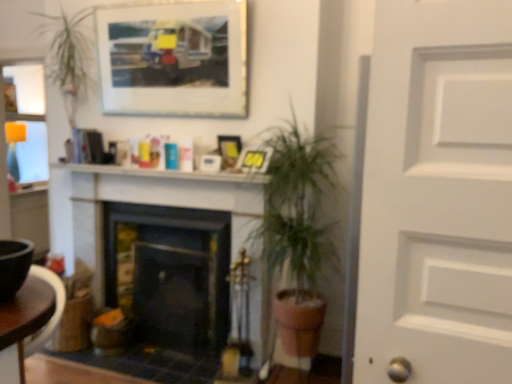
What do you see at coordinates (229, 150) in the screenshot? The width and height of the screenshot is (512, 384). I see `matte plastic picture frame at center, positioned as the second picture frame in top-to-bottom order` at bounding box center [229, 150].

Locate an element on the screen. The width and height of the screenshot is (512, 384). matte plastic picture frame at upper center, which ranks as the 3th picture frame in top-to-bottom order is located at coordinates (254, 160).

This screenshot has width=512, height=384. I want to click on green leafy plant at center, so click(x=298, y=207).

In order to face wooden frame at upper center, which is the 3th picture frame from bottom to top, should I rotate leftwards or rightwards?

You should rotate left by 11.805 degrees.

What is the approximate height of black matte fireplace at center, placed as the first fireplace when sorted from right to left?

94.80 centimeters.

Describe the element at coordinates (29, 320) in the screenshot. I see `brown wooden table at lower left` at that location.

The width and height of the screenshot is (512, 384). I want to click on matte plastic picture frame at center, positioned as the second picture frame in top-to-bottom order, so click(x=229, y=150).

Can you confirm if brown wooden table at lower left is shorter than matte plastic picture frame at center, positioned as the second picture frame in top-to-bottom order?

In fact, brown wooden table at lower left may be taller than matte plastic picture frame at center, positioned as the second picture frame in top-to-bottom order.

The height and width of the screenshot is (384, 512). In order to click on the 2nd picture frame above the brown wooden table at lower left (from the image's perspective) in this screenshot , I will do `click(229, 150)`.

Does brown wooden table at lower left have a lesser width compared to matte plastic picture frame at center, positioned as the second picture frame in top-to-bottom order?

In fact, brown wooden table at lower left might be wider than matte plastic picture frame at center, positioned as the second picture frame in top-to-bottom order.

Is brown wooden table at lower left to the right of matte plastic picture frame at center, which ranks as the second picture frame in bottom-to-top order, from the viewer's perspective?

In fact, brown wooden table at lower left is to the left of matte plastic picture frame at center, which ranks as the second picture frame in bottom-to-top order.

Starting from the green leafy plant at center, which picture frame is the 1st one behind? Please provide its 2D coordinates.

[(254, 160)]

Is point (294, 267) positioned after point (242, 152)?

No.

Does green leafy plant at center turn towards matte plastic picture frame at upper center, which ranks as the 3th picture frame in top-to-bottom order?

No, green leafy plant at center is not turned towards matte plastic picture frame at upper center, which ranks as the 3th picture frame in top-to-bottom order.

Measure the distance between green leafy plant at center and white glossy mantel at upper center.

15.46 inches.

Identify the location of mantle lying above the green leafy plant at center (from the image's perspective). The width and height of the screenshot is (512, 384). (165, 173).

Which is farther, (331, 245) or (112, 174)?

The point (112, 174) is farther.

Does green leafy plant at center appear on the left side of white glossy mantel at upper center?

No, green leafy plant at center is not to the left of white glossy mantel at upper center.

Between point (230, 160) and point (211, 99), which one is positioned behind?

The point (211, 99) is farther.

Does matte plastic picture frame at center, which ranks as the second picture frame in bottom-to-top order, have a lesser width compared to wooden frame at upper center, which is the 3th picture frame from bottom to top?

Yes, matte plastic picture frame at center, which ranks as the second picture frame in bottom-to-top order, is thinner than wooden frame at upper center, which is the 3th picture frame from bottom to top.

Which of these two, matte plastic picture frame at center, which ranks as the second picture frame in bottom-to-top order, or wooden frame at upper center, which is the 3th picture frame from bottom to top, is bigger?

With larger size is wooden frame at upper center, which is the 3th picture frame from bottom to top.

From a real-world perspective, between matte plastic picture frame at center, positioned as the second picture frame in top-to-bottom order, and wooden frame at upper center, which appears as the 1th picture frame when viewed from the top, who is vertically higher?

wooden frame at upper center, which appears as the 1th picture frame when viewed from the top, is physically above.

Is white glossy mantel at upper center not near matte plastic picture frame at center, which ranks as the second picture frame in bottom-to-top order?

white glossy mantel at upper center is near matte plastic picture frame at center, which ranks as the second picture frame in bottom-to-top order, not far away.

Is white glossy mantel at upper center positioned before matte plastic picture frame at center, positioned as the second picture frame in top-to-bottom order?

Yes, white glossy mantel at upper center is closer to the viewer.

Is white glossy mantel at upper center turned away from matte plastic picture frame at center, positioned as the second picture frame in top-to-bottom order?

white glossy mantel at upper center does not have its back to matte plastic picture frame at center, positioned as the second picture frame in top-to-bottom order.

Does white glossy mantel at upper center have a smaller size compared to matte plastic picture frame at center, which ranks as the second picture frame in bottom-to-top order?

Actually, white glossy mantel at upper center might be larger than matte plastic picture frame at center, which ranks as the second picture frame in bottom-to-top order.

Considering the points (36, 273) and (318, 249), which point is behind, point (36, 273) or point (318, 249)?

The point (318, 249) is farther.

Does brown wooden table at lower left have a greater height compared to green leafy plant at center?

In fact, brown wooden table at lower left may be shorter than green leafy plant at center.

Is brown wooden table at lower left positioned far away from green leafy plant at center?

Yes, brown wooden table at lower left and green leafy plant at center are quite far apart.

Is brown wooden table at lower left positioned behind green leafy plant at center?

No, brown wooden table at lower left is in front of green leafy plant at center.

Does matte plastic picture frame at center, which ranks as the second picture frame in bottom-to-top order, have a greater width compared to black matte fireplace at center, the first fireplace in the left-to-right sequence?

No, matte plastic picture frame at center, which ranks as the second picture frame in bottom-to-top order, is not wider than black matte fireplace at center, the first fireplace in the left-to-right sequence.

Is matte plastic picture frame at center, which ranks as the second picture frame in bottom-to-top order, bigger or smaller than black matte fireplace at center, the first fireplace in the left-to-right sequence?

matte plastic picture frame at center, which ranks as the second picture frame in bottom-to-top order, is smaller than black matte fireplace at center, the first fireplace in the left-to-right sequence.

In the scene shown: From a real-world perspective, does matte plastic picture frame at center, which ranks as the second picture frame in bottom-to-top order, sit lower than black matte fireplace at center, the 2th fireplace viewed from the right?

No, from a real-world perspective, matte plastic picture frame at center, which ranks as the second picture frame in bottom-to-top order, is not below black matte fireplace at center, the 2th fireplace viewed from the right.

Is matte plastic picture frame at center, which ranks as the second picture frame in bottom-to-top order, further to camera compared to black matte fireplace at center, the first fireplace in the left-to-right sequence?

Yes, the depth of matte plastic picture frame at center, which ranks as the second picture frame in bottom-to-top order, is greater than that of black matte fireplace at center, the first fireplace in the left-to-right sequence.

At what (x,y) coordinates should I click in order to perform the action: click on table located below the matte plastic picture frame at center, which ranks as the second picture frame in bottom-to-top order (from the image's perspective). Please return your answer as a coordinate pair (x, y). Looking at the image, I should click on (29, 320).

This screenshot has width=512, height=384. In order to click on houseplant below the matte plastic picture frame at upper center, which ranks as the 3th picture frame in top-to-bottom order (from a real-world perspective) in this screenshot , I will do `click(298, 207)`.

Considering their positions, is green leafy plant at center positioned further to matte plastic picture frame at upper center, the first picture frame in the bottom-to-top sequence, than white glossy mantel at upper center?

green leafy plant at center is further to matte plastic picture frame at upper center, the first picture frame in the bottom-to-top sequence.

Considering their positions, is black matte fireplace at center, the 2th fireplace viewed from the right, positioned further to matte plastic picture frame at upper center, which ranks as the 3th picture frame in top-to-bottom order, than brown wooden table at lower left?

brown wooden table at lower left.

From the image, which object appears to be nearer to matte plastic picture frame at upper center, which ranks as the 3th picture frame in top-to-bottom order, matte plastic picture frame at center, positioned as the second picture frame in top-to-bottom order, or black matte fireplace at center, which appears as the 2th fireplace when viewed from the left?

Based on the image, matte plastic picture frame at center, positioned as the second picture frame in top-to-bottom order, appears to be nearer to matte plastic picture frame at upper center, which ranks as the 3th picture frame in top-to-bottom order.

Estimate the real-world distances between objects in this image. Which object is closer to matte plastic picture frame at center, which ranks as the second picture frame in bottom-to-top order, green leafy plant at center or wooden frame at upper center, which appears as the 1th picture frame when viewed from the top?

green leafy plant at center is closer to matte plastic picture frame at center, which ranks as the second picture frame in bottom-to-top order.

Looking at the image, which one is located closer to green leafy plant at center, black matte fireplace at center, placed as the first fireplace when sorted from right to left, or wooden frame at upper center, which appears as the 1th picture frame when viewed from the top?

black matte fireplace at center, placed as the first fireplace when sorted from right to left, is closer to green leafy plant at center.

Looking at the image, which one is located closer to black matte fireplace at center, placed as the first fireplace when sorted from right to left, matte plastic picture frame at center, positioned as the second picture frame in top-to-bottom order, or brown wooden table at lower left?

Among the two, matte plastic picture frame at center, positioned as the second picture frame in top-to-bottom order, is located nearer to black matte fireplace at center, placed as the first fireplace when sorted from right to left.

Looking at this image, when comparing their distances from matte plastic picture frame at center, positioned as the second picture frame in top-to-bottom order, does green leafy plant at center or black matte fireplace at center, which appears as the 2th fireplace when viewed from the left, seem closer?

Among the two, green leafy plant at center is located nearer to matte plastic picture frame at center, positioned as the second picture frame in top-to-bottom order.

Estimate the real-world distances between objects in this image. Which object is further from matte plastic picture frame at center, which ranks as the second picture frame in bottom-to-top order, white glossy mantel at upper center or brown wooden table at lower left?

brown wooden table at lower left is positioned further to the anchor matte plastic picture frame at center, which ranks as the second picture frame in bottom-to-top order.

I want to click on mantle that lies between matte plastic picture frame at upper center, the first picture frame in the bottom-to-top sequence, and black matte fireplace at center, the first fireplace in the left-to-right sequence, from top to bottom, so click(x=165, y=173).

Find the location of a particular element. This screenshot has width=512, height=384. mantle between wooden frame at upper center, which appears as the 1th picture frame when viewed from the top, and brown wooden table at lower left in the up-down direction is located at coordinates (165, 173).

This screenshot has width=512, height=384. What are the coordinates of `mantle between wooden frame at upper center, which appears as the 1th picture frame when viewed from the top, and green leafy plant at center, in the vertical direction` in the screenshot? It's located at (165, 173).

Find the location of a particular element. picture frame between matte plastic picture frame at center, which ranks as the second picture frame in bottom-to-top order, and black matte fireplace at center, the first fireplace in the left-to-right sequence, vertically is located at coordinates (254, 160).